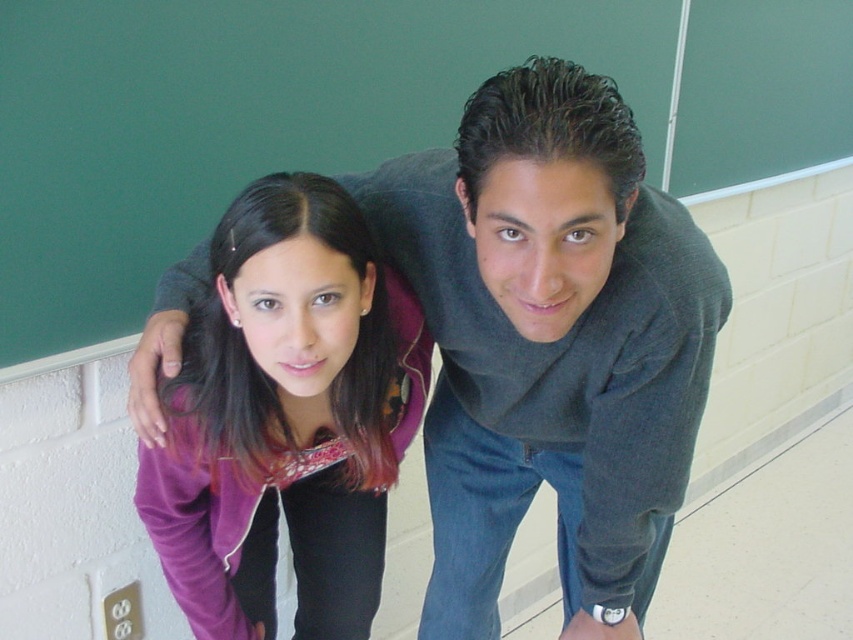
Question: Which object is closer to the camera taking this photo?

Choices:
 (A) matte gray sweater at center
 (B) purple fleece jacket at center
 (C) green chalkboard at upper center

Answer: (A)

Question: Considering the relative positions of green chalkboard at upper center and purple fleece jacket at center in the image provided, where is green chalkboard at upper center located with respect to purple fleece jacket at center?

Choices:
 (A) right
 (B) left

Answer: (A)

Question: Is green chalkboard at upper center further to the viewer compared to purple fleece jacket at center?

Choices:
 (A) no
 (B) yes

Answer: (B)

Question: Which object is the farthest from the matte gray sweater at center?

Choices:
 (A) green chalkboard at upper center
 (B) purple fleece jacket at center

Answer: (A)

Question: Does matte gray sweater at center appear on the left side of purple fleece jacket at center?

Choices:
 (A) no
 (B) yes

Answer: (A)

Question: Which point is closer to the camera taking this photo?

Choices:
 (A) (415, 224)
 (B) (360, 442)
 (C) (741, 132)

Answer: (A)